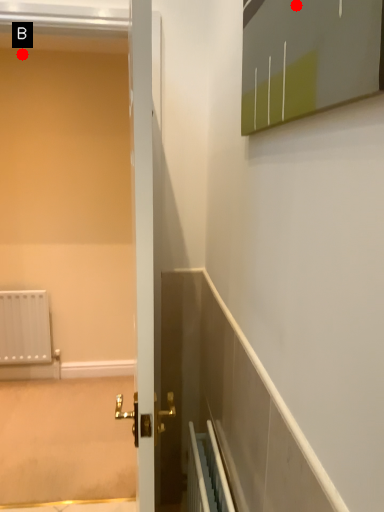
Question: Two points are circled on the image, labeled by A and B beside each circle. Which point is further to the camera?

Choices:
 (A) A is further
 (B) B is further

Answer: (B)